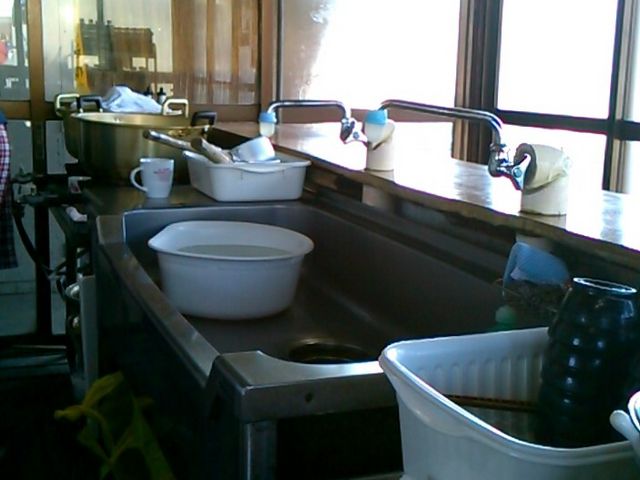
Where is `window pane`? window pane is located at coordinates (472, 58).